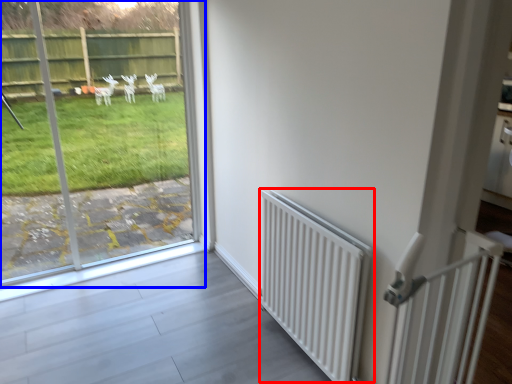
Question: Among these objects, which one is farthest to the camera, radiator (highlighted by a red box) or window (highlighted by a blue box)?

Choices:
 (A) radiator
 (B) window

Answer: (B)